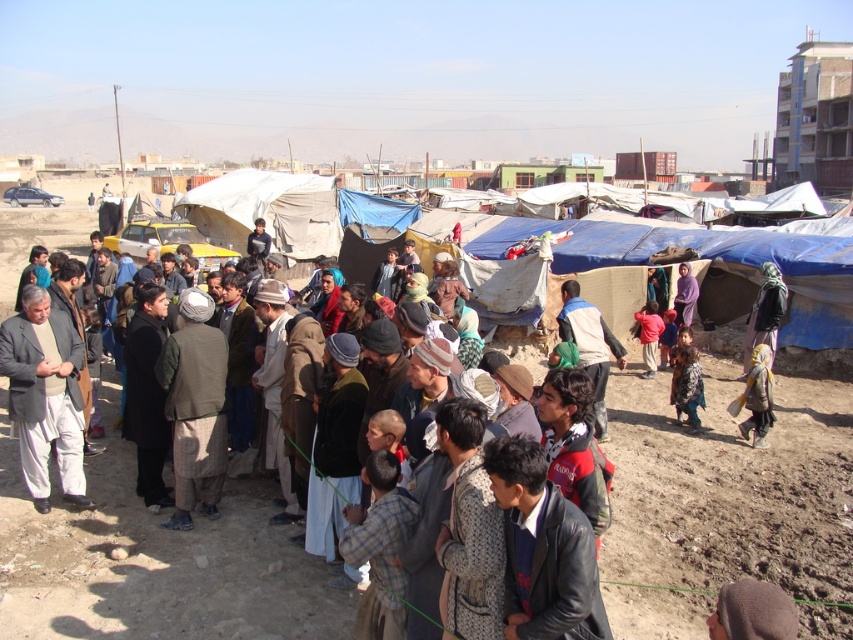
You are a humanitarian aid worker distributing jackets to people in a refugee camp. You have two jackets available, the light brown fabric jacket at left and the brown woolen jacket at center. A person comes asking for the larger jacket. Which jacket should you give them?

The light brown fabric jacket at left is bigger than the brown woolen jacket at center, so you should give them the light brown fabric jacket at left.

You are a photographer trying to capture a clear shot of the leather jacket at center and the dark blue jacket at center. Since they are both at the center, which one is blocking the view of the other?

The leather jacket at center is in front of dark blue jacket at center, so the leather jacket at center is blocking the view of the dark blue jacket at center.

You are standing at point (567, 336) and want to walk to the distant hills in the background. Is the point (573, 624) between you and the hills?

Point (573, 624) is in front of point (567, 336), so yes, the point (573, 624) is between you and the hills.